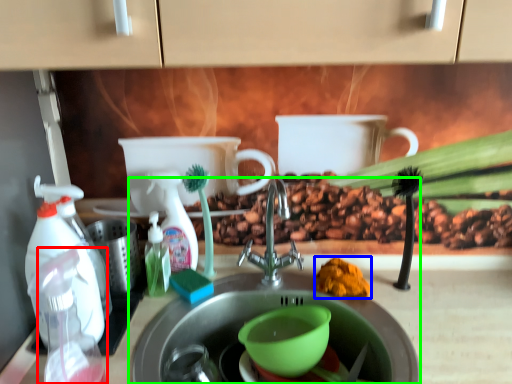
Question: Which object is the closest to the bottle (highlighted by a red box)? Choose among these: debris (highlighted by a blue box) or sink (highlighted by a green box).

Choices:
 (A) debris
 (B) sink

Answer: (B)